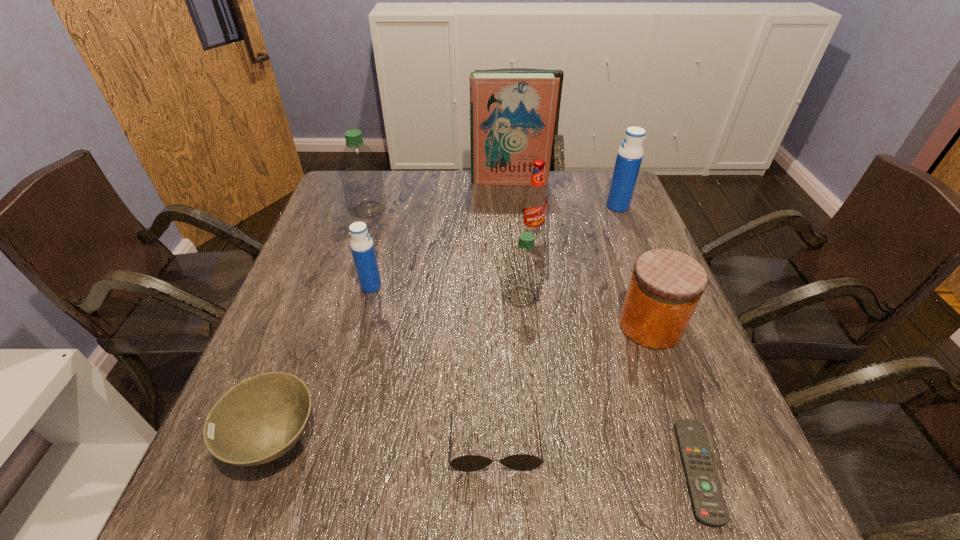
The width and height of the screenshot is (960, 540). In order to click on the nearer green water bottle in this screenshot , I will do `click(524, 267)`.

Identify the location of the smaller green water bottle. The height and width of the screenshot is (540, 960). (524, 267).

This screenshot has width=960, height=540. I want to click on orange jar, so click(x=666, y=285).

Find the location of a particular element. The image size is (960, 540). the third shortest object is located at coordinates (262, 418).

Locate an element on the screen. The image size is (960, 540). bowl is located at coordinates (262, 418).

You are a GUI agent. You are given a task and a screenshot of the screen. Output one action in this format:
    pyautogui.click(x=<x>, y=<y>)
    Task: Click on the black sunglasses
    
    Given the screenshot: What is the action you would take?
    pyautogui.click(x=522, y=462)

The height and width of the screenshot is (540, 960). Find the location of `the ninth tallest object`. the ninth tallest object is located at coordinates (522, 462).

Identify the location of the shortest object. (709, 507).

Where is `free spot located 0.060m on the cover of the tallest object`? free spot located 0.060m on the cover of the tallest object is located at coordinates (511, 196).

Identify the location of vacant space situated on the left of the bigger blue water bottle. This screenshot has height=540, width=960. (542, 206).